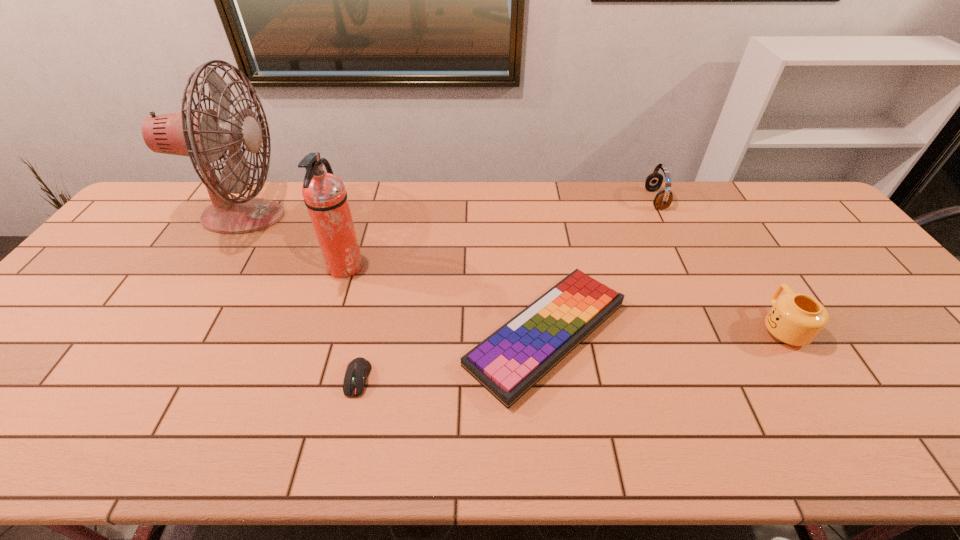
I want to click on free region located in front of the leftmost object to direct airflow, so click(x=319, y=217).

Identify the location of free spot located 0.130m at the nozzle of the fire extinguisher. The image size is (960, 540). (408, 267).

You are a GUI agent. You are given a task and a screenshot of the screen. Output one action in this format:
    pyautogui.click(x=<x>, y=<y>)
    Task: Click on the free space located 0.220m on the ear cups of the headset
    
    Given the screenshot: What is the action you would take?
    pyautogui.click(x=583, y=199)

Locate an element on the screen. vacant space situated 0.250m on the ear cups of the headset is located at coordinates (574, 199).

Find the location of a particular element. vacant region located 0.370m on the ear cups of the headset is located at coordinates (539, 199).

Find the location of a particular element. This screenshot has height=540, width=960. vacant position located 0.380m on the handle side of the rightmost object is located at coordinates (714, 217).

The image size is (960, 540). Identify the location of vacant space located 0.070m on the handle side of the rightmost object. (756, 285).

The height and width of the screenshot is (540, 960). What are the coordinates of `vacant space located on the handle side of the rightmost object` in the screenshot? It's located at (740, 258).

Locate an element on the screen. free space located 0.330m on the left of the computer keyboard is located at coordinates (329, 334).

What are the coordinates of `vacant region located 0.080m on the button of the fourth object from right to left` in the screenshot? It's located at (346, 433).